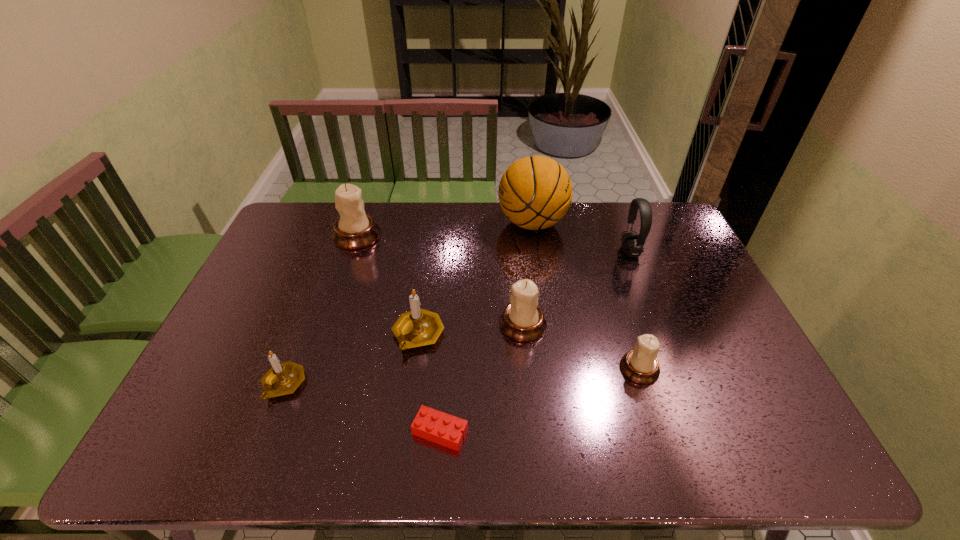
You are a GUI agent. You are given a task and a screenshot of the screen. Output one action in this format:
    pyautogui.click(x=<x>, y=<y>)
    Task: Click on the vacant area that satisfies the following two spatial constraints: 1. on the front-facing side of the headset; 2. on the front side of the smallest white candle holder
    Image resolution: width=960 pixels, height=540 pixels.
    Given the screenshot: What is the action you would take?
    pyautogui.click(x=676, y=369)

At what (x,y) coordinates should I click in order to perform the action: click on vacant point that satisfies the following two spatial constraints: 1. on the back side of the second candle holder from right to left; 2. on the right side of the left gold candle holder. Please return your answer as a coordinate pair (x, y). Looking at the image, I should click on [x=306, y=325].

Locate an element on the screen. The image size is (960, 540). free space in the image that satisfies the following two spatial constraints: 1. on the front side of the smallest white candle holder; 2. on the right side of the farther gold candle holder is located at coordinates (414, 369).

Find the location of `vacant region that satisfies the following two spatial constraints: 1. on the surface of the tallest object near the brand logo; 2. on the right side of the nearest white candle holder`. vacant region that satisfies the following two spatial constraints: 1. on the surface of the tallest object near the brand logo; 2. on the right side of the nearest white candle holder is located at coordinates (553, 369).